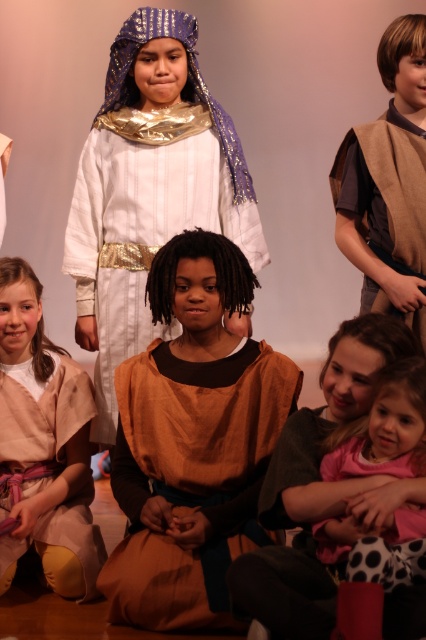
Which is below, pink fabric dress at lower right or shiny gold fabric headdress at upper center?

pink fabric dress at lower right is below.

Is pink fabric dress at lower right thinner than shiny gold fabric headdress at upper center?

Yes, pink fabric dress at lower right is thinner than shiny gold fabric headdress at upper center.

Who is more distant from viewer, (259,516) or (232,170)?

Point (232,170)

Locate an element on the screen. pink fabric dress at lower right is located at coordinates (313, 486).

Who is more forward, (184, 122) or (186, 29)?

Positioned in front is point (186, 29).

Is white satin robe at center taller than shiny gold fabric headdress at upper center?

Yes, white satin robe at center is taller than shiny gold fabric headdress at upper center.

Who is more forward, (101, 228) or (117, 104)?

Point (117, 104)

The image size is (426, 640). Find the location of `white satin robe at center`. white satin robe at center is located at coordinates (143, 225).

Consider the image. Can you confirm if pink fabric dress at lower right is shorter than brown suede vest at upper right?

Correct, pink fabric dress at lower right is not as tall as brown suede vest at upper right.

Who is lower down, pink fabric dress at lower right or brown suede vest at upper right?

Positioned lower is pink fabric dress at lower right.

At what (x,y) coordinates should I click in order to perform the action: click on pink fabric dress at lower right. Please return your answer as a coordinate pair (x, y). Looking at the image, I should click on [x=313, y=486].